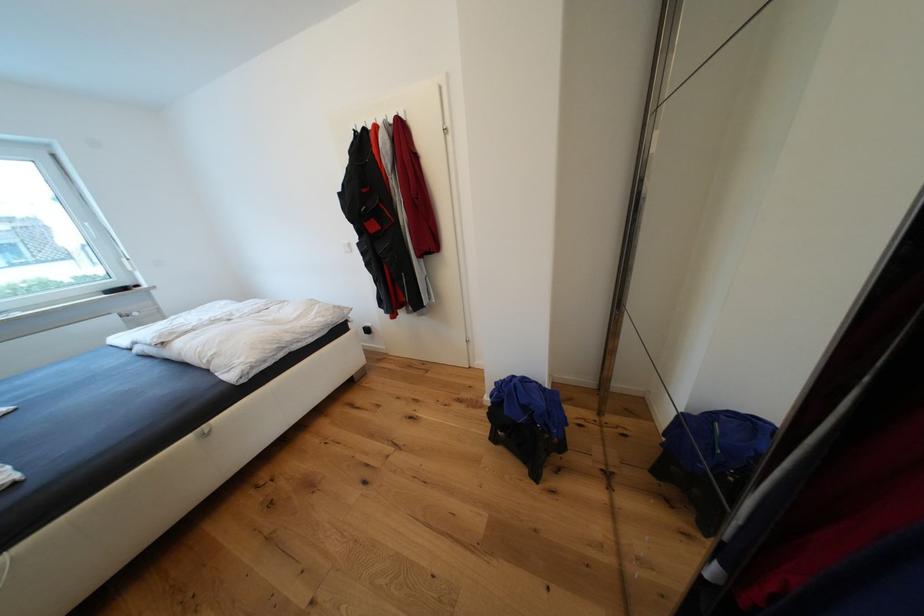
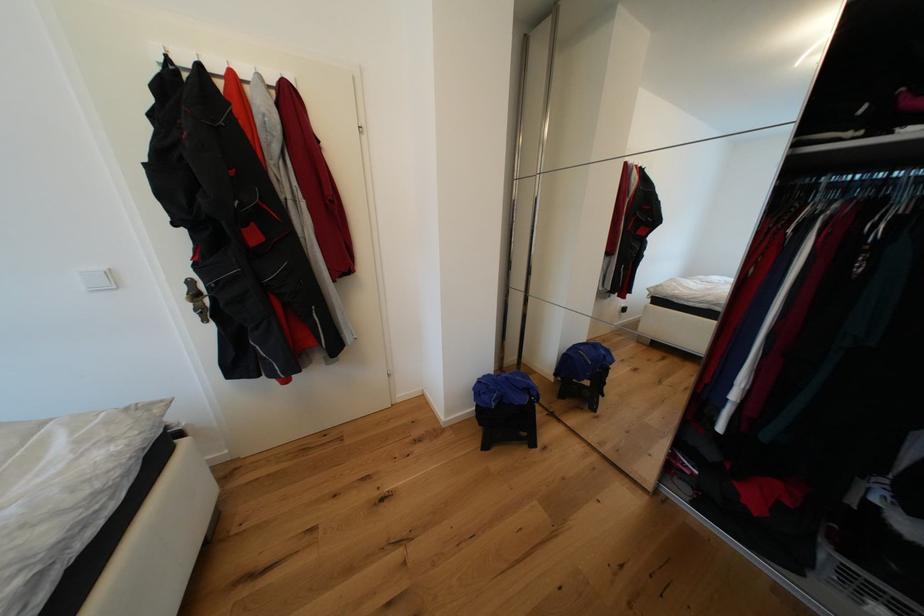
Question: The camera is either moving clockwise (left) or counter-clockwise (right) around the object. The first image is from the beginning of the video and the second image is from the end. Is the camera moving left or right when shooting the video?

Choices:
 (A) Left
 (B) Right

Answer: (A)